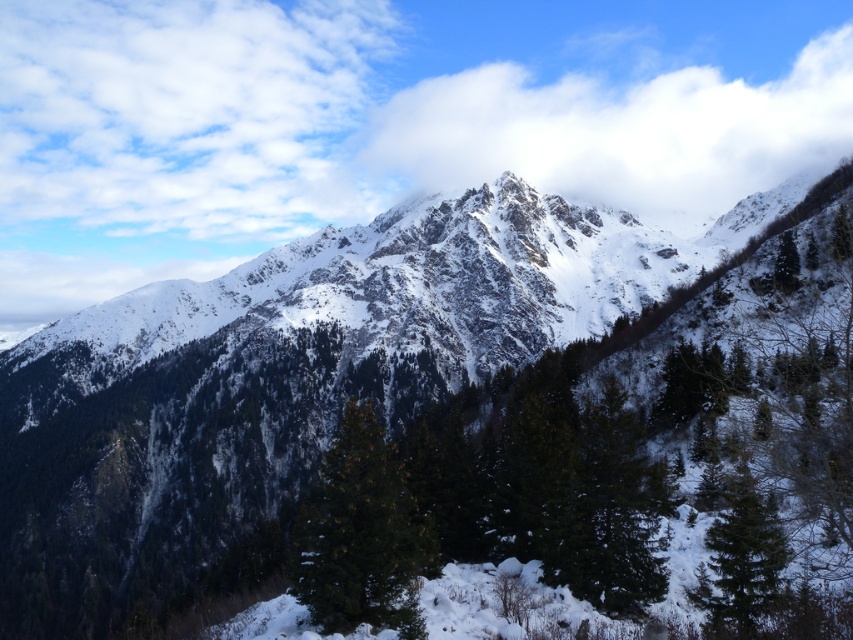
Question: Can you confirm if green matte tree at lower right is positioned above green matte tree at right?

Choices:
 (A) no
 (B) yes

Answer: (A)

Question: Which point is closer to the camera taking this photo?

Choices:
 (A) (366, 548)
 (B) (604, 440)

Answer: (A)

Question: Estimate the real-world distances between objects in this image. Which object is farther from the white fluffy cloud at upper center?

Choices:
 (A) green matte tree at lower right
 (B) green textured pine tree at center
 (C) green matte tree at center
 (D) green matte tree at right

Answer: (A)

Question: From the image, what is the correct spatial relationship of green matte tree at center in relation to green matte tree at lower right?

Choices:
 (A) below
 (B) above

Answer: (B)

Question: Observing the image, what is the correct spatial positioning of green matte tree at lower right in reference to green matte tree at right?

Choices:
 (A) left
 (B) right

Answer: (A)

Question: Which object is farther from the camera taking this photo?

Choices:
 (A) green matte tree at center
 (B) white fluffy cloud at upper center

Answer: (B)